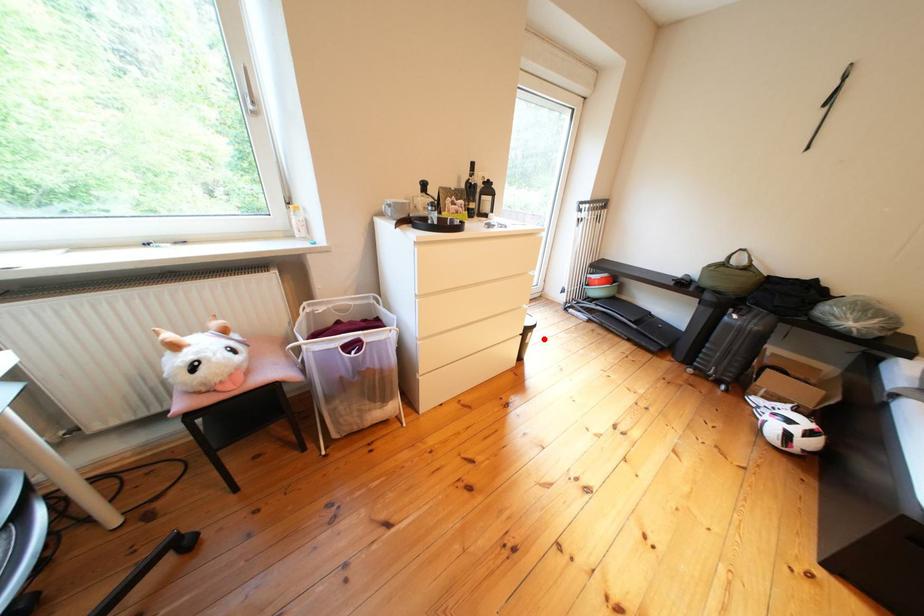
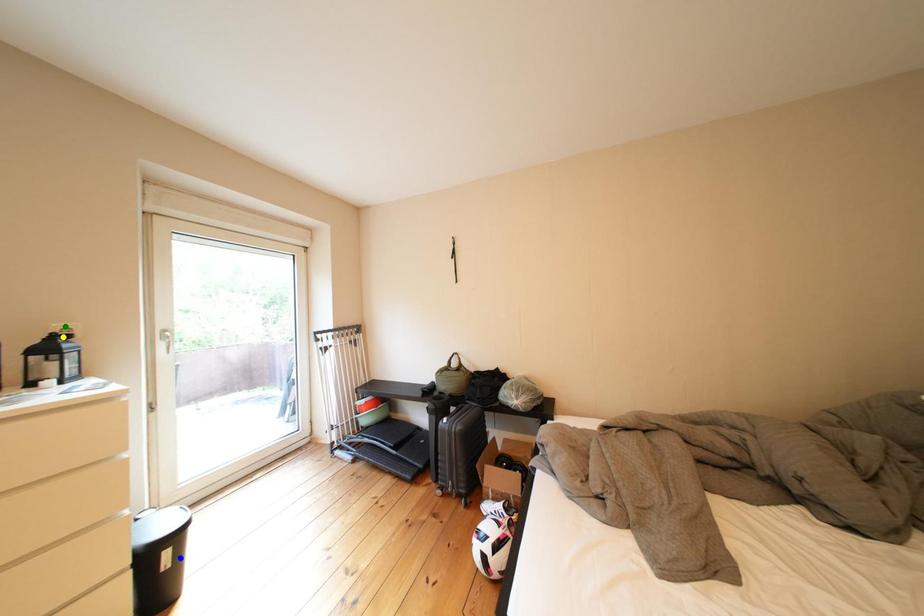
Question: I am providing you with two images of the same scene from different viewpoints. A red point is marked on the first image. You are given multiple points on the second image. Which point in image 2 represents the same 3d spot as the red point in image 1?

Choices:
 (A) green point
 (B) yellow point
 (C) blue point

Answer: (C)